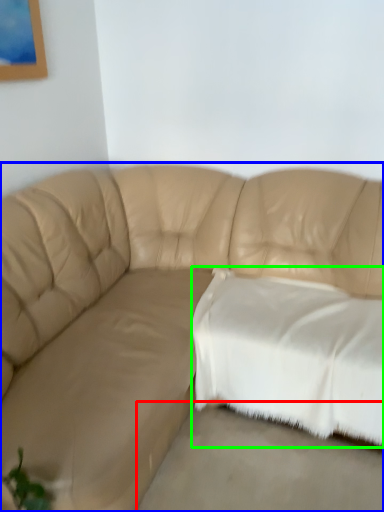
Question: Which object is positioned closest to concrete (highlighted by a red box)? Select from studio couch (highlighted by a blue box) and pillow (highlighted by a green box).

Choices:
 (A) studio couch
 (B) pillow

Answer: (B)